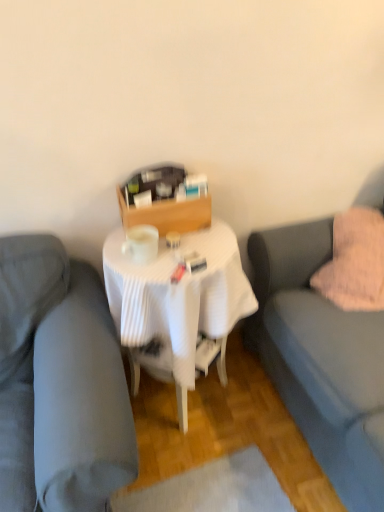
Question: Do you think white pleated tablecloth at center is within matte gray couch at center, which appears as the second studio couch when viewed from the right, or outside of it?

Choices:
 (A) outside
 (B) inside

Answer: (A)

Question: Considering the positions of white pleated tablecloth at center and matte gray couch at center, which appears as the second studio couch when viewed from the right, in the image, is white pleated tablecloth at center taller or shorter than matte gray couch at center, which appears as the second studio couch when viewed from the right,?

Choices:
 (A) short
 (B) tall

Answer: (A)

Question: Which is nearer to the soft gray fabric couch at right, the second studio couch in the left-to-right sequence?

Choices:
 (A) pink fluffy pillow at right
 (B) white pleated tablecloth at center
 (C) matte gray couch at center, the first studio couch positioned from the left

Answer: (A)

Question: Estimate the real-world distances between objects in this image. Which object is farther from the white pleated tablecloth at center?

Choices:
 (A) pink fluffy pillow at right
 (B) matte gray couch at center, which appears as the second studio couch when viewed from the right
 (C) soft gray fabric couch at right, arranged as the 1th studio couch when viewed from the right

Answer: (A)